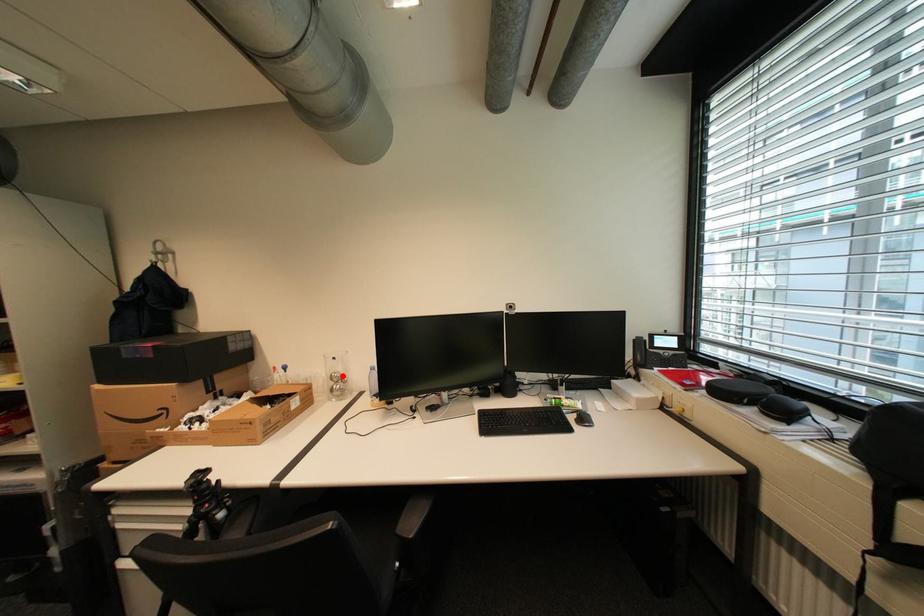
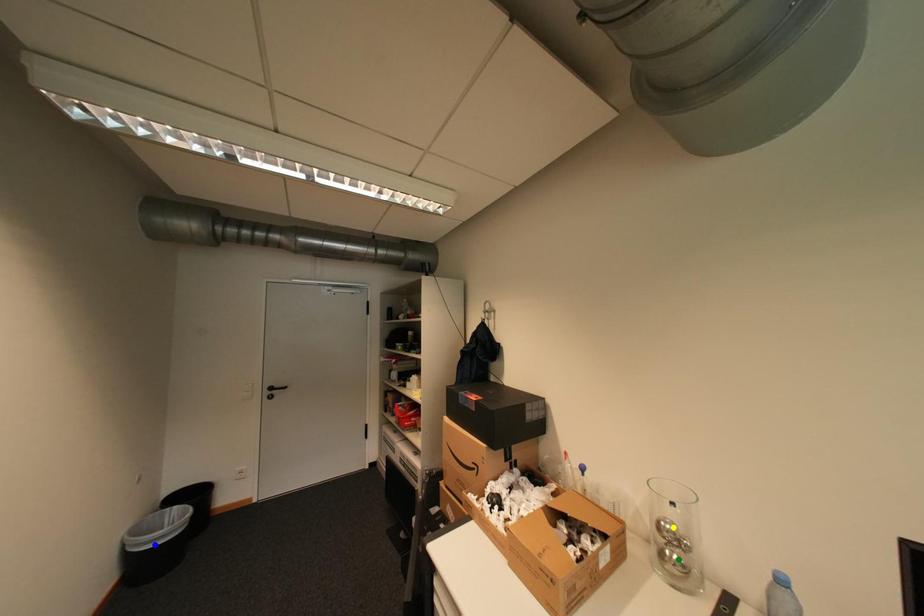
Question: I am providing you with two images of the same scene from different viewpoints. A red point is marked on the first image. You are given multiple points on the second image. In image 2, which mark is for the same physical point as the one in image 1?

Choices:
 (A) green point
 (B) blue point
 (C) yellow point

Answer: (C)